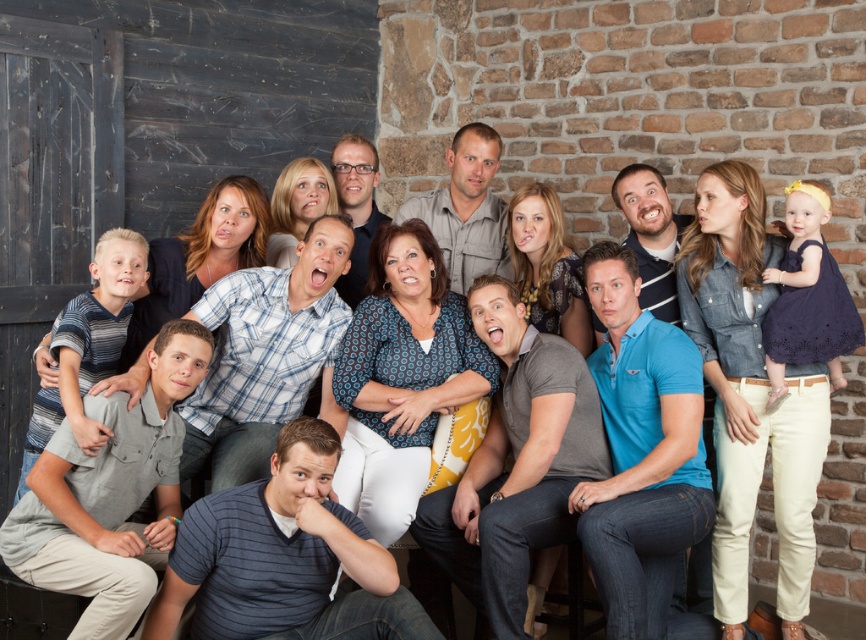
You are standing in the room and want to find the light brown shirt at center. According to the coordinates provided, where should you look relative to the center of the image?

The light brown shirt at center is located at coordinates point (466, 209), which is slightly to the left and below the center of the image.

You are organizing a photo shoot and need to ensure that the light brown shirt at center and the matte blue shirt at center are visible in the final image. Given their sizes, which shirt might you need to position closer to the camera to ensure both are equally visible?

The light brown shirt at center is bigger than the matte blue shirt at center. To ensure both are equally visible, you can position the matte blue shirt at center closer to the camera since it is smaller and needs to appear larger in the frame.

From the picture: You are taking a photo of the group and notice two people in the center wearing a light brown shirt at center and a matte blue shirt at center. Which one is blocking the view of the other?

The matte blue shirt at center is behind the light brown shirt at center, so the light brown shirt at center is blocking the view of the matte blue shirt at center.